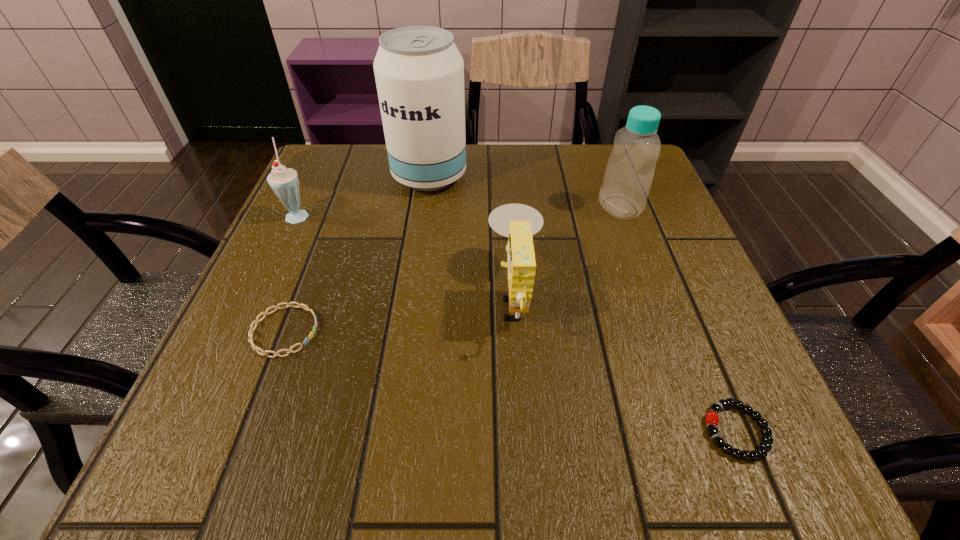
The width and height of the screenshot is (960, 540). Find the location of `bracelet positioned at the left edge`. bracelet positioned at the left edge is located at coordinates (266, 312).

Locate an element on the screen. bottle located in the right edge section of the desktop is located at coordinates (629, 173).

At what (x,y) coordinates should I click in order to perform the action: click on bracelet at the right edge. Please return your answer as a coordinate pair (x, y). Looking at the image, I should click on (712, 418).

The width and height of the screenshot is (960, 540). I want to click on object that is at the far right corner, so click(629, 173).

At what (x,y) coordinates should I click in order to perform the action: click on object that is at the near right corner. Please return your answer as a coordinate pair (x, y). Looking at the image, I should click on (712, 418).

Locate an element on the screen. The height and width of the screenshot is (540, 960). vacant space at the near edge is located at coordinates (599, 430).

The height and width of the screenshot is (540, 960). Identify the location of vacant region at the left edge of the desktop. (321, 243).

Where is `free space at the right edge`? Image resolution: width=960 pixels, height=540 pixels. free space at the right edge is located at coordinates (652, 272).

The height and width of the screenshot is (540, 960). In the image, there is a desktop. Find the location of `vacant region at the far left corner`. vacant region at the far left corner is located at coordinates (364, 151).

Locate an element on the screen. free space at the far right corner of the desktop is located at coordinates coord(597,163).